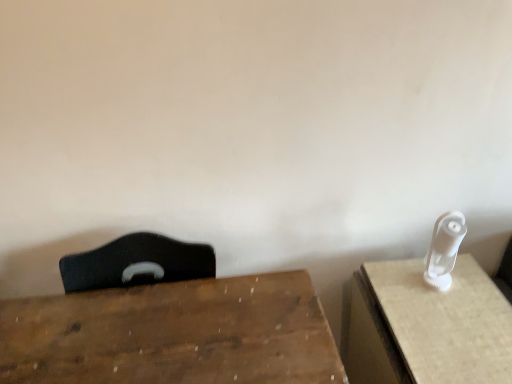
What do you see at coordinates (444, 249) in the screenshot? I see `white plastic wii controller at right` at bounding box center [444, 249].

The height and width of the screenshot is (384, 512). What are the coordinates of `wooden table at center, the 2th table positioned from the right` in the screenshot? It's located at (173, 334).

At what (x,y) coordinates should I click in order to perform the action: click on white plastic toothbrush at right, which appears as the second table when viewed from the left. Please return your answer as a coordinate pair (x, y). This screenshot has width=512, height=384. Looking at the image, I should click on (425, 326).

Where is `white plastic wii controller at right`? This screenshot has width=512, height=384. white plastic wii controller at right is located at coordinates (444, 249).

From a real-world perspective, is white plastic toothbrush at right, which appears as the second table when viewed from the left, on wooden table at center, which ranks as the 1th table in left-to-right order?

No.

Between white plastic toothbrush at right, placed as the 1th table when sorted from right to left, and wooden table at center, which ranks as the 1th table in left-to-right order, which one has smaller width?

With smaller width is white plastic toothbrush at right, placed as the 1th table when sorted from right to left.

Measure the distance between white plastic toothbrush at right, placed as the 1th table when sorted from right to left, and wooden table at center, which ranks as the 1th table in left-to-right order.

The distance of white plastic toothbrush at right, placed as the 1th table when sorted from right to left, from wooden table at center, which ranks as the 1th table in left-to-right order, is 14.04 inches.

From the image's perspective, which table is the 1st one below the white plastic wii controller at right? Please provide its 2D coordinates.

[(173, 334)]

Considering the positions of point (436, 258) and point (55, 309), is point (436, 258) closer or farther from the camera than point (55, 309)?

Point (436, 258) appears to be farther away from the viewer than point (55, 309).

Between white plastic wii controller at right and wooden table at center, which ranks as the 1th table in left-to-right order, which one has smaller width?

With smaller width is white plastic wii controller at right.

Considering the relative sizes of white plastic toothbrush at right, placed as the 1th table when sorted from right to left, and white plastic wii controller at right in the image provided, is white plastic toothbrush at right, placed as the 1th table when sorted from right to left, smaller than white plastic wii controller at right?

Incorrect, white plastic toothbrush at right, placed as the 1th table when sorted from right to left, is not smaller in size than white plastic wii controller at right.

Which object is closer to the camera, white plastic toothbrush at right, which appears as the second table when viewed from the left, or white plastic wii controller at right?

white plastic toothbrush at right, which appears as the second table when viewed from the left, is in front.

Locate an element on the screen. Image resolution: width=512 pixels, height=384 pixels. the 2nd table positioned below the white plastic wii controller at right (from a real-world perspective) is located at coordinates (425, 326).

Is white plastic toothbrush at right, which appears as the second table when viewed from the left, wider than white plastic wii controller at right?

Yes, white plastic toothbrush at right, which appears as the second table when viewed from the left, is wider than white plastic wii controller at right.

Measure the distance between wooden table at center, the 2th table positioned from the right, and white plastic wii controller at right.

wooden table at center, the 2th table positioned from the right, is 22.72 inches away from white plastic wii controller at right.

Is point (211, 321) positioned after point (436, 235)?

No, (211, 321) is in front of (436, 235).

Is wooden table at center, which ranks as the 1th table in left-to-right order, bigger than white plastic wii controller at right?

Indeed, wooden table at center, which ranks as the 1th table in left-to-right order, has a larger size compared to white plastic wii controller at right.

Where is `Wii controller on the right side of wooden table at center, which ranks as the 1th table in left-to-right order`? Wii controller on the right side of wooden table at center, which ranks as the 1th table in left-to-right order is located at coordinates (444, 249).

From the image's perspective, does wooden table at center, which ranks as the 1th table in left-to-right order, appear lower than white plastic toothbrush at right, which appears as the second table when viewed from the left?

No, from the image's perspective, wooden table at center, which ranks as the 1th table in left-to-right order, is not beneath white plastic toothbrush at right, which appears as the second table when viewed from the left.

Considering the relative sizes of wooden table at center, the 2th table positioned from the right, and white plastic toothbrush at right, placed as the 1th table when sorted from right to left, in the image provided, is wooden table at center, the 2th table positioned from the right, shorter than white plastic toothbrush at right, placed as the 1th table when sorted from right to left,?

Incorrect, the height of wooden table at center, the 2th table positioned from the right, does not fall short of that of white plastic toothbrush at right, placed as the 1th table when sorted from right to left.

Is wooden table at center, which ranks as the 1th table in left-to-right order, not near white plastic toothbrush at right, which appears as the second table when viewed from the left?

No, wooden table at center, which ranks as the 1th table in left-to-right order, is not far from white plastic toothbrush at right, which appears as the second table when viewed from the left.

Is white plastic wii controller at right surrounding white plastic toothbrush at right, which appears as the second table when viewed from the left?

That's incorrect, white plastic toothbrush at right, which appears as the second table when viewed from the left, is not inside white plastic wii controller at right.

Based on their positions, is white plastic wii controller at right located to the left or right of white plastic toothbrush at right, which appears as the second table when viewed from the left?

white plastic wii controller at right is positioned on white plastic toothbrush at right, which appears as the second table when viewed from the left,'s left side.

In the scene shown: From the image's perspective, is white plastic wii controller at right on top of white plastic toothbrush at right, placed as the 1th table when sorted from right to left?

Indeed, from the image's perspective, white plastic wii controller at right is shown above white plastic toothbrush at right, placed as the 1th table when sorted from right to left.

Considering the relative sizes of white plastic wii controller at right and white plastic toothbrush at right, which appears as the second table when viewed from the left, in the image provided, is white plastic wii controller at right taller than white plastic toothbrush at right, which appears as the second table when viewed from the left,?

In fact, white plastic wii controller at right may be shorter than white plastic toothbrush at right, which appears as the second table when viewed from the left.

In the image, there is a wooden table at center, which ranks as the 1th table in left-to-right order. Where is `table below it (from the image's perspective)`? This screenshot has height=384, width=512. table below it (from the image's perspective) is located at coordinates (425, 326).

The width and height of the screenshot is (512, 384). I want to click on Wii controller that is behind the wooden table at center, which ranks as the 1th table in left-to-right order, so click(x=444, y=249).

Looking at the image, which one is located further to white plastic wii controller at right, white plastic toothbrush at right, which appears as the second table when viewed from the left, or wooden table at center, the 2th table positioned from the right?

The object further to white plastic wii controller at right is wooden table at center, the 2th table positioned from the right.

Looking at the image, which one is located further to white plastic toothbrush at right, which appears as the second table when viewed from the left, wooden table at center, the 2th table positioned from the right, or white plastic wii controller at right?

wooden table at center, the 2th table positioned from the right, lies further to white plastic toothbrush at right, which appears as the second table when viewed from the left, than the other object.

Which object lies nearer to the anchor point wooden table at center, which ranks as the 1th table in left-to-right order, white plastic toothbrush at right, which appears as the second table when viewed from the left, or white plastic wii controller at right?

Among the two, white plastic toothbrush at right, which appears as the second table when viewed from the left, is located nearer to wooden table at center, which ranks as the 1th table in left-to-right order.

Estimate the real-world distances between objects in this image. Which object is closer to white plastic toothbrush at right, placed as the 1th table when sorted from right to left, white plastic wii controller at right or wooden table at center, which ranks as the 1th table in left-to-right order?

The object closer to white plastic toothbrush at right, placed as the 1th table when sorted from right to left, is white plastic wii controller at right.

Based on their spatial positions, is wooden table at center, the 2th table positioned from the right, or white plastic toothbrush at right, placed as the 1th table when sorted from right to left, further from white plastic wii controller at right?

wooden table at center, the 2th table positioned from the right, is further to white plastic wii controller at right.

Based on their spatial positions, is white plastic wii controller at right or white plastic toothbrush at right, which appears as the second table when viewed from the left, further from wooden table at center, the 2th table positioned from the right?

The object further to wooden table at center, the 2th table positioned from the right, is white plastic wii controller at right.

You are a GUI agent. You are given a task and a screenshot of the screen. Output one action in this format:
    pyautogui.click(x=<x>, y=<y>)
    Task: Click on the Wii controller between wooden table at center, the 2th table positioned from the right, and white plastic toothbrush at right, placed as the 1th table when sorted from right to left, in the horizontal direction
    This screenshot has height=384, width=512.
    Given the screenshot: What is the action you would take?
    pyautogui.click(x=444, y=249)